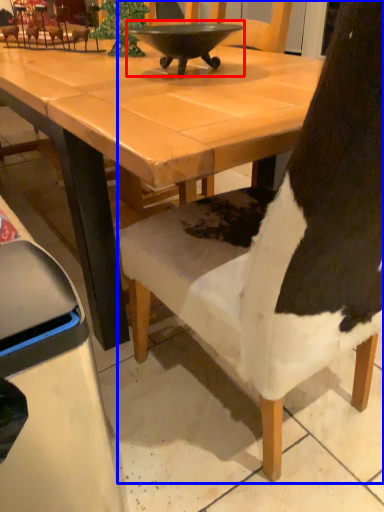
Question: Which point is further to the camera, bowl (highlighted by a red box) or chair (highlighted by a blue box)?

Choices:
 (A) bowl
 (B) chair

Answer: (A)